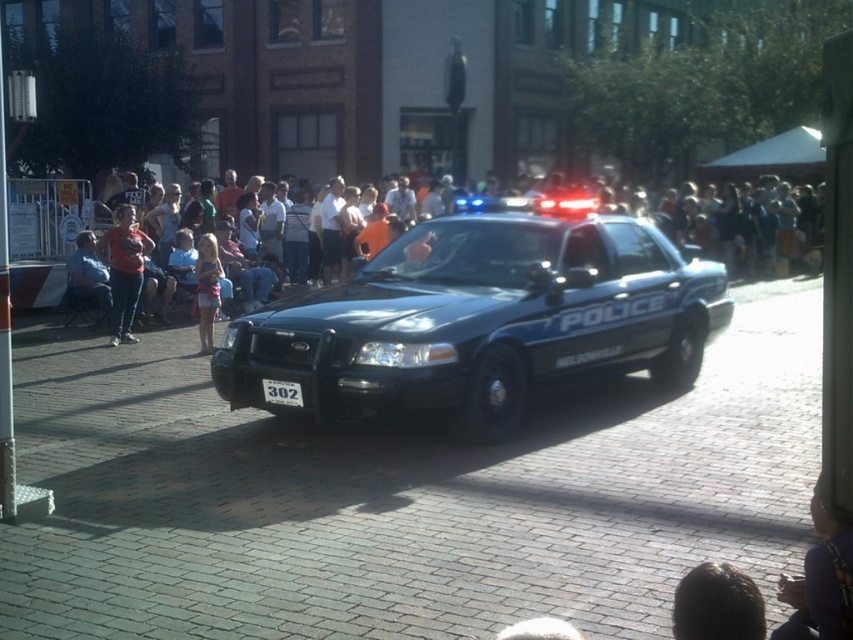
Measure the distance between purple fabric at center and camera.

9.52 feet

The image size is (853, 640). What do you see at coordinates (821, 579) in the screenshot? I see `purple fabric at center` at bounding box center [821, 579].

This screenshot has width=853, height=640. Find the location of `purple fabric at center`. purple fabric at center is located at coordinates (821, 579).

Is white cotton shirt at center shorter than light pink fabric dress at center?

Incorrect, white cotton shirt at center's height does not fall short of light pink fabric dress at center's.

Is point (190, 257) positioned after point (202, 314)?

Yes, it is behind point (202, 314).

Which is behind, point (158, 193) or point (209, 278)?

Point (158, 193)

Where is `white cotton shirt at center`? The width and height of the screenshot is (853, 640). white cotton shirt at center is located at coordinates (183, 280).

Which is more to the left, matte red shirt at left or light pink fabric dress at center?

From the viewer's perspective, matte red shirt at left appears more on the left side.

Who is more distant from viewer, (134, 216) or (218, 305)?

The point (134, 216) is behind.

Identify the location of matte red shirt at left. This screenshot has height=640, width=853. (125, 269).